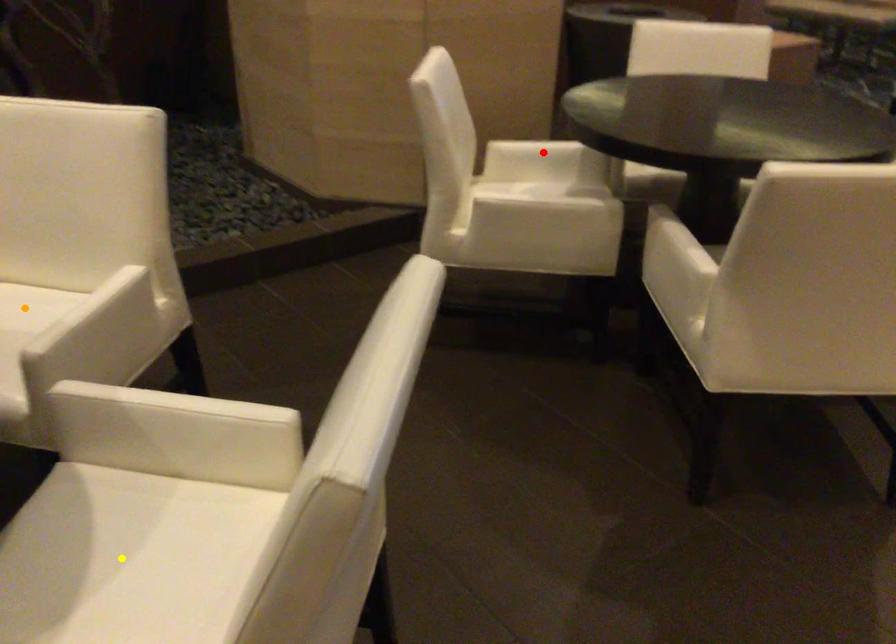
Order these from farthest to nearest:
1. yellow point
2. red point
3. orange point

1. red point
2. orange point
3. yellow point